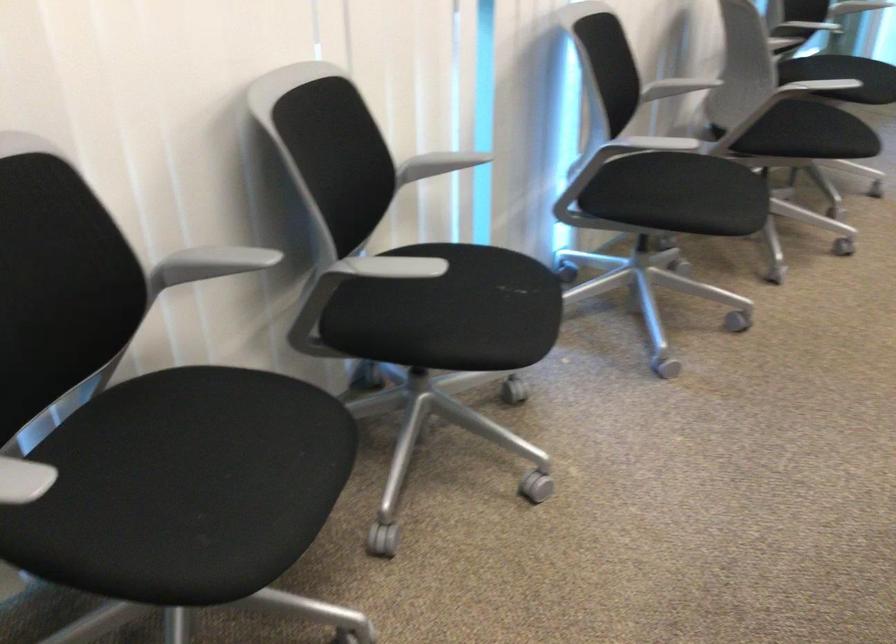
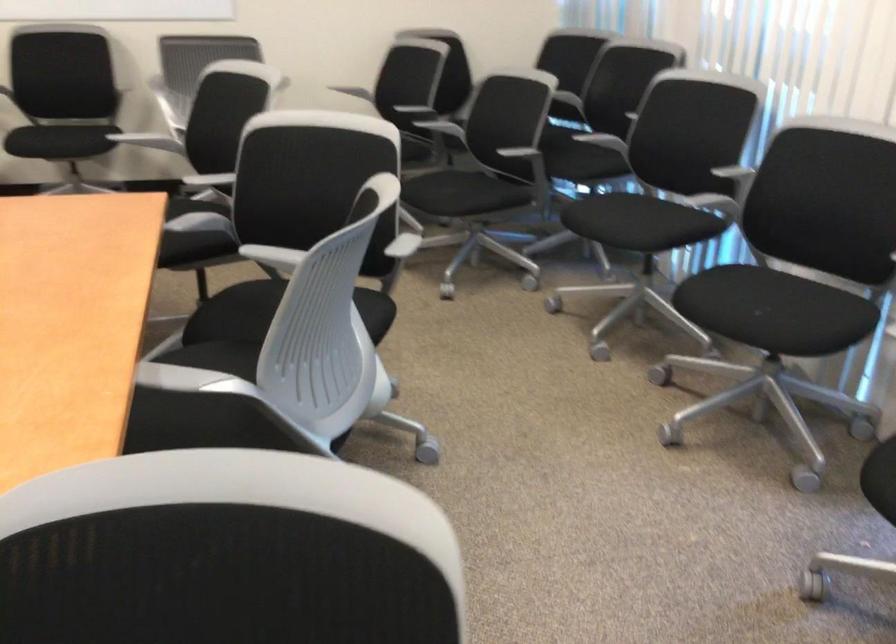
Locate, in the second image, the point that corresponds to [488,279] in the first image.

(771, 310)